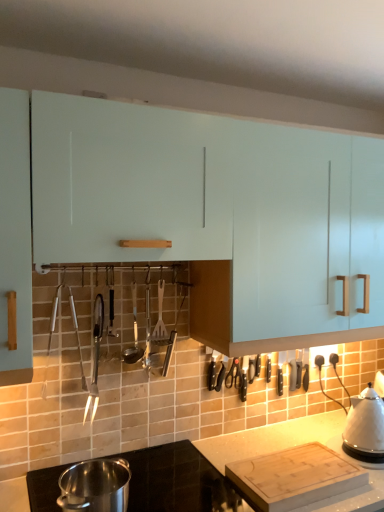
Question: In terms of height, does wooden spatula at center, positioned as the third silverware in left-to-right order, look taller or shorter compared to white glossy kettle at right, the 2th kitchen appliance in the left-to-right sequence?

Choices:
 (A) short
 (B) tall

Answer: (B)

Question: Is wooden spatula at center, positioned as the third silverware in left-to-right order, wider or thinner than white glossy kettle at right, the 2th kitchen appliance in the left-to-right sequence?

Choices:
 (A) thin
 (B) wide

Answer: (A)

Question: Which is farther from the wooden spatula at center, positioned as the third silverware in left-to-right order?

Choices:
 (A) white glossy cabinet at upper center
 (B) smooth white countertop at lower center
 (C) polished stainless steel ladle at center, which appears as the second silverware when viewed from the left
 (D) shiny metallic tongs at center left, arranged as the first silverware when viewed from the left
 (E) polished stainless steel pot at lower left, which is the first kitchen appliance in left-to-right order

Answer: (A)

Question: Which object is the farthest from the polished stainless steel pot at lower left, which is the first kitchen appliance in left-to-right order?

Choices:
 (A) white glossy cabinet at upper center
 (B) wooden spatula at center, positioned as the third silverware in left-to-right order
 (C) smooth white countertop at lower center
 (D) shiny metallic tongs at center left, which is the 3th silverware in right-to-left order
 (E) polished stainless steel ladle at center, which appears as the second silverware when viewed from the left

Answer: (A)